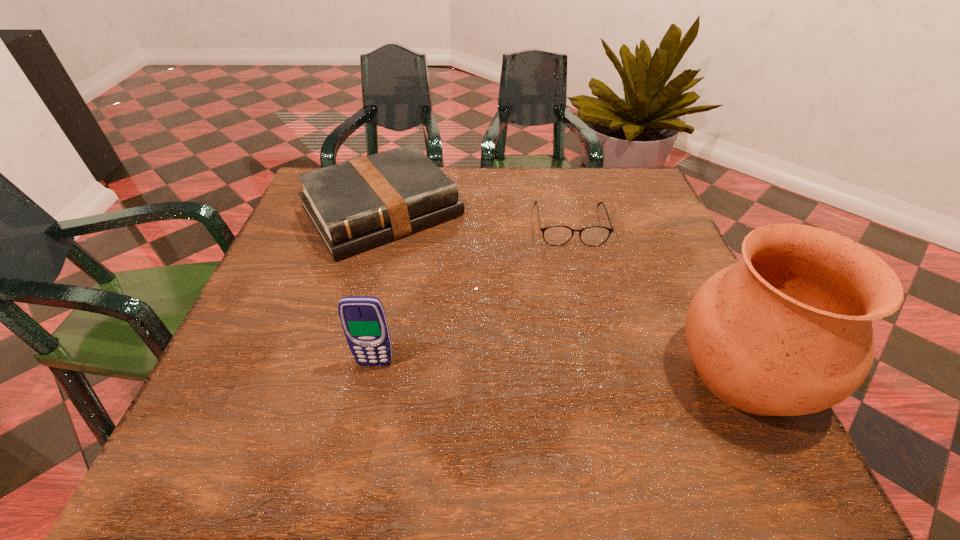
Find the location of a particular element. Image resolution: width=960 pixels, height=540 pixels. cellular telephone is located at coordinates (363, 318).

Where is `the rightmost object`? Image resolution: width=960 pixels, height=540 pixels. the rightmost object is located at coordinates (787, 331).

You are a GUI agent. You are given a task and a screenshot of the screen. Output one action in this format:
    pyautogui.click(x=<x>, y=<y>)
    Task: Click on the pottery
    
    Given the screenshot: What is the action you would take?
    pyautogui.click(x=787, y=331)

This screenshot has width=960, height=540. I want to click on the third object from left to right, so click(x=556, y=235).

The width and height of the screenshot is (960, 540). I want to click on spectacles, so click(x=556, y=235).

The width and height of the screenshot is (960, 540). What are the coordinates of `the second shortest object` in the screenshot? It's located at (356, 205).

This screenshot has height=540, width=960. Find the location of `free space located on the back of the rightmost object`. free space located on the back of the rightmost object is located at coordinates (679, 241).

Where is `free space located 0.070m on the front-facing side of the shortest object`? free space located 0.070m on the front-facing side of the shortest object is located at coordinates (579, 267).

Locate an element on the screen. The height and width of the screenshot is (540, 960). free region located 0.270m on the front-facing side of the shortest object is located at coordinates (593, 339).

Where is `free space located 0.260m on the front-facing side of the shortest object`? Image resolution: width=960 pixels, height=540 pixels. free space located 0.260m on the front-facing side of the shortest object is located at coordinates (592, 334).